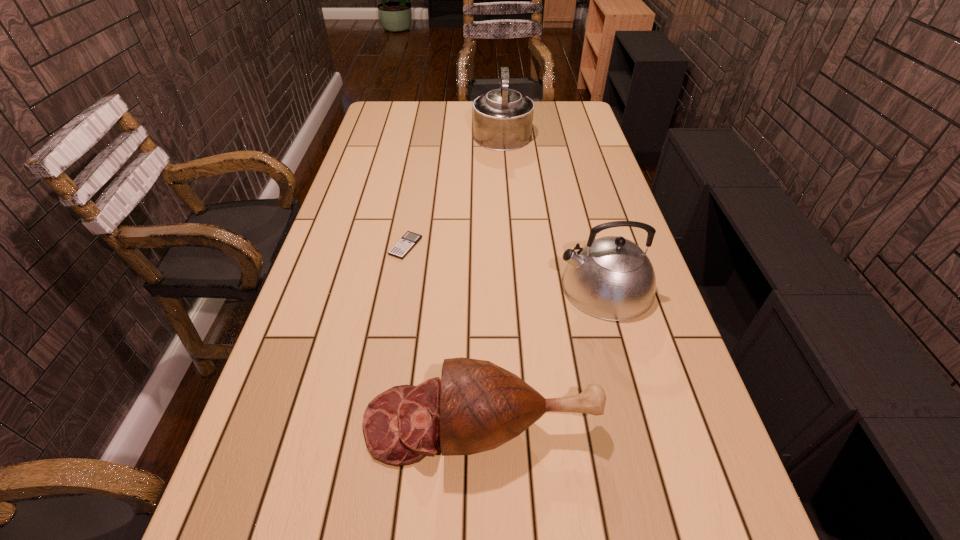
Identify the location of the taller kettle. The width and height of the screenshot is (960, 540). (502, 118).

Locate an element on the screen. This screenshot has height=540, width=960. the tallest object is located at coordinates [502, 118].

What are the coordinates of `the shorter kettle` in the screenshot? It's located at (611, 278).

You are a GUI agent. You are given a task and a screenshot of the screen. Output one action in this format:
    pyautogui.click(x=<x>, y=<y>)
    Task: Click on the third shortest object
    This screenshot has height=540, width=960.
    Given the screenshot: What is the action you would take?
    coord(611,278)

At what (x,y) coordinates should I click in order to perform the action: click on the nearest object. Please return your answer as a coordinate pair (x, y). The image size is (960, 540). Looking at the image, I should click on (476, 406).

Identify the location of ham. (476, 406).

The width and height of the screenshot is (960, 540). Find the location of `calculator`. calculator is located at coordinates (409, 239).

At what (x,y) coordinates should I click in order to perform the action: click on vacant point located 0.060m with the spout at the front of the tallest object. Please return your answer as a coordinate pair (x, y). The width and height of the screenshot is (960, 540). Looking at the image, I should click on (500, 109).

At what (x,y) coordinates should I click in order to perform the action: click on free space located 0.320m from the spout of the shorter kettle. Please return your answer as a coordinate pair (x, y). The height and width of the screenshot is (540, 960). Looking at the image, I should click on (437, 286).

Find the location of a particular element. The width and height of the screenshot is (960, 540). free space located from the spout of the shorter kettle is located at coordinates (528, 286).